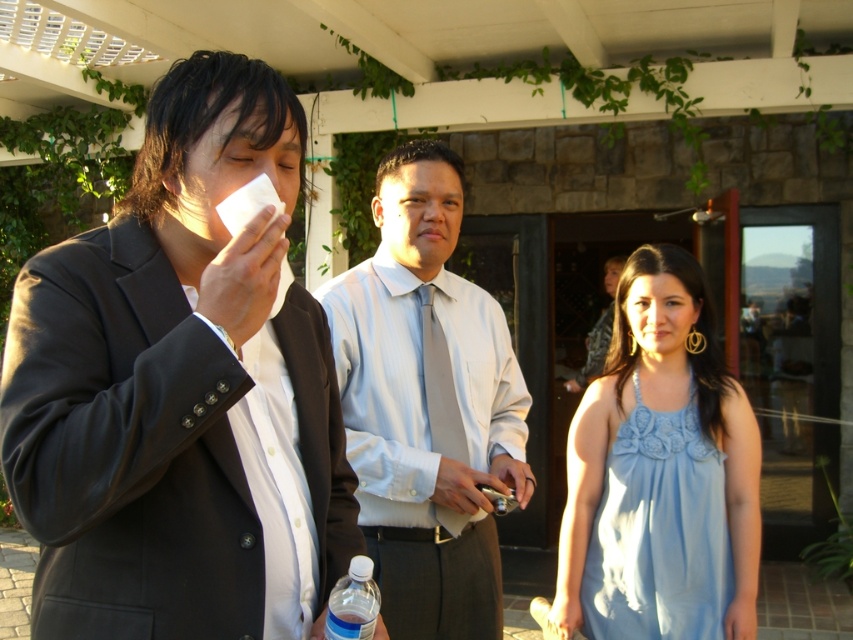
Between point (160, 532) and point (403, 500), which one is positioned in front?

Point (160, 532) is in front.

Is black matte suit at left shorter than light blue shirt at center?

Yes, black matte suit at left is shorter than light blue shirt at center.

Find the location of `black matte suit at left`. black matte suit at left is located at coordinates (180, 390).

Identify the location of black matte suit at left. (180, 390).

Is black matte suit at left wider than clear plastic bottle at lower center?

Yes.

Does black matte suit at left appear over clear plastic bottle at lower center?

Correct, black matte suit at left is located above clear plastic bottle at lower center.

At what (x,y) coordinates should I click in order to perform the action: click on black matte suit at left. Please return your answer as a coordinate pair (x, y). This screenshot has height=640, width=853. Looking at the image, I should click on (180, 390).

Who is positioned more to the left, light blue shirt at center or clear plastic bottle at lower center?

clear plastic bottle at lower center is more to the left.

Does light blue shirt at center appear on the left side of clear plastic bottle at lower center?

In fact, light blue shirt at center is to the right of clear plastic bottle at lower center.

The width and height of the screenshot is (853, 640). I want to click on light blue shirt at center, so click(427, 404).

The height and width of the screenshot is (640, 853). I want to click on light blue shirt at center, so click(x=427, y=404).